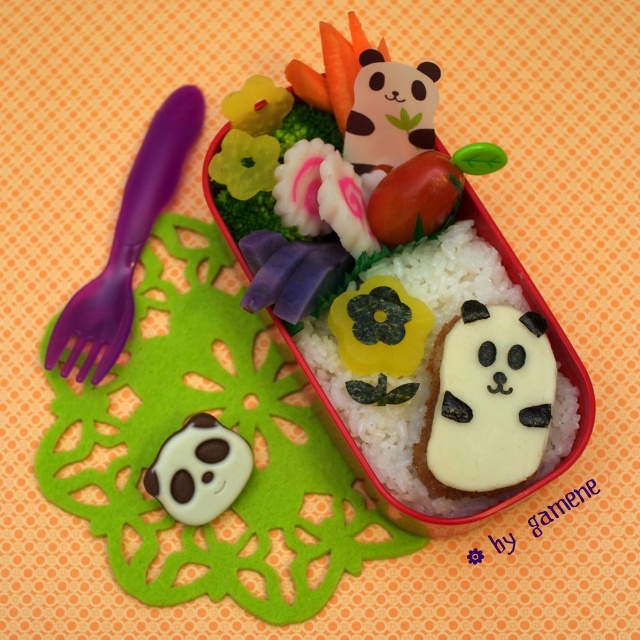
Question: Which point is farther from the camera taking this photo?

Choices:
 (A) (477, 150)
 (B) (435, 385)
 (C) (449, 298)
 (D) (154, 173)

Answer: (D)

Question: Can you confirm if white cheese at center is positioned to the left of matte tomato at upper center?

Choices:
 (A) no
 (B) yes

Answer: (A)

Question: Is white cheese panda at center in front of white cheese at center?

Choices:
 (A) no
 (B) yes

Answer: (A)

Question: Which point appears farthest from the camera in this image?

Choices:
 (A) coord(186,138)
 (B) coord(460,340)
 (C) coord(532,474)
 (D) coord(477,156)

Answer: (A)

Question: Among these objects, which one is nearest to the camera?

Choices:
 (A) purple plastic fork at left
 (B) white cheese at center
 (C) matte tomato at upper center
 (D) white rice at center

Answer: (B)

Question: Is white rice at center to the left of purple plastic fork at left from the viewer's perspective?

Choices:
 (A) yes
 (B) no

Answer: (B)